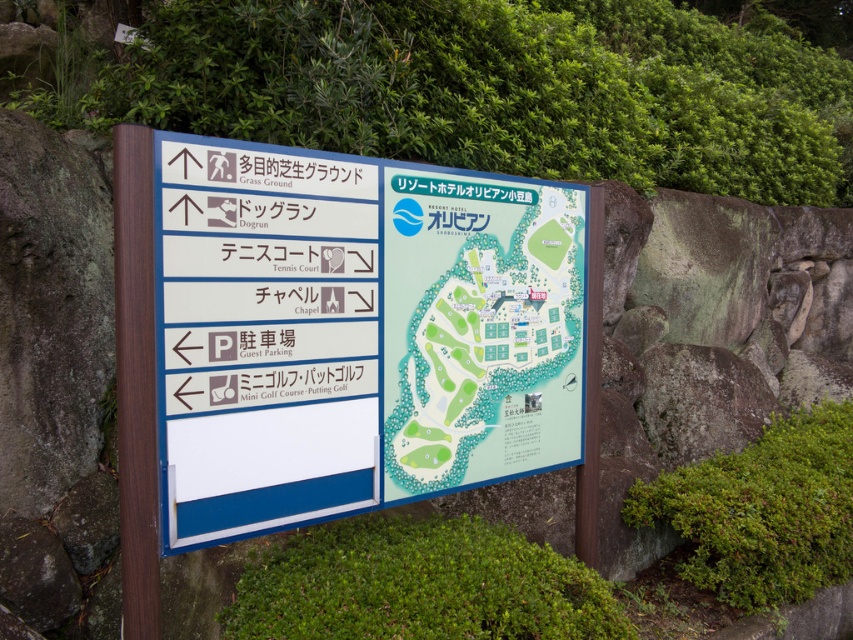
You are standing in front of the wooden signboard at center and the green paper map at center. Which object is closer to you?

The wooden signboard at center is closer to you because it is in front of the green paper map at center.

Based on the provided scene description, what object is located at the coordinates point (357, 332)?

The point (357, 332) corresponds to the wooden signboard at center.

You are standing in front of the wooden signboard at center and the green paper map at center. Which object is taller?

The wooden signboard at center is much taller than the green paper map at center.